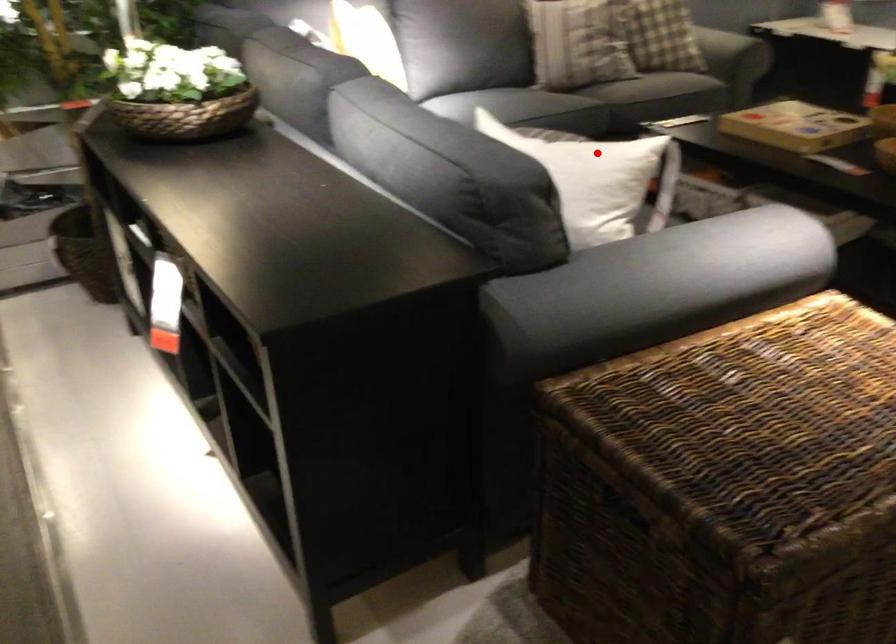
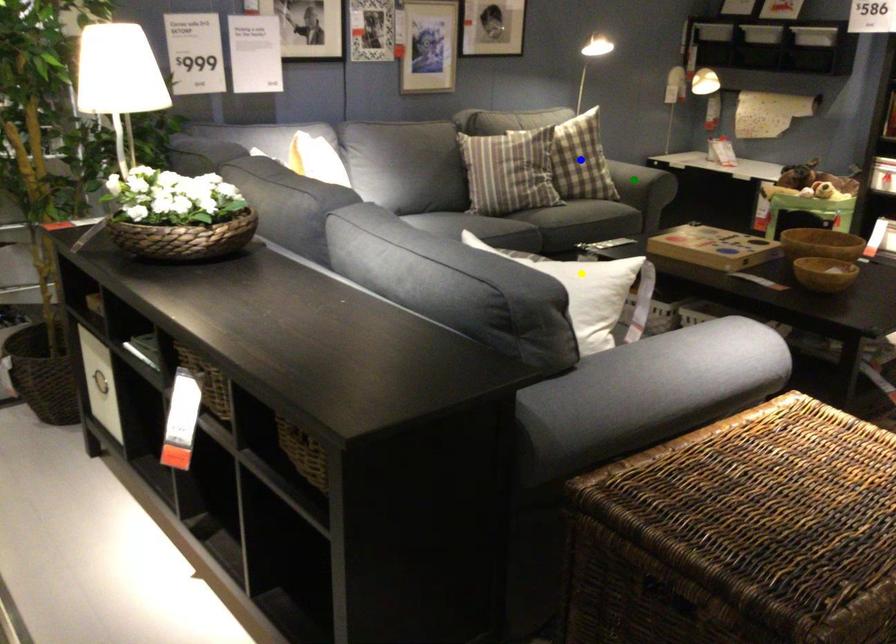
Question: I am providing you with two images of the same scene from different viewpoints. A red point is marked on the first image. You are given multiple points on the second image. In image 2, which mark is for the same physical point as the one in image 1?

Choices:
 (A) green point
 (B) yellow point
 (C) blue point

Answer: (B)